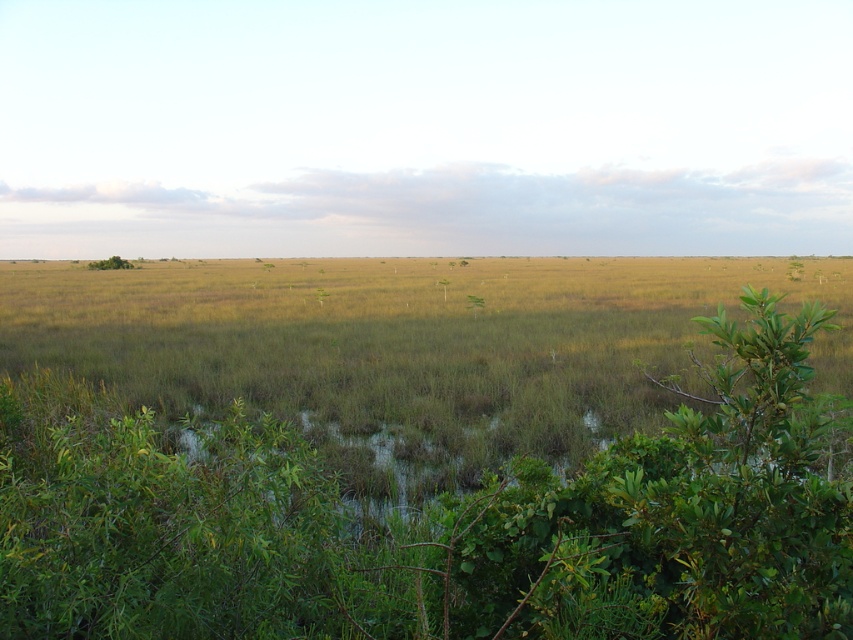
Question: Where is green leafy tree at center-right located in relation to green grassy tree at center in the image?

Choices:
 (A) above
 (B) below

Answer: (A)

Question: Which point is closer to the camera?

Choices:
 (A) green leafy tree at upper left
 (B) green leafy tree at center-right

Answer: (B)

Question: In this image, where is green leafy tree at center-right located relative to green grassy tree at center?

Choices:
 (A) above
 (B) below

Answer: (A)

Question: Can you confirm if green leafy tree at upper left is positioned to the left of green grassy tree at center?

Choices:
 (A) no
 (B) yes

Answer: (B)

Question: Which point is closer to the camera taking this photo?

Choices:
 (A) (120, 268)
 (B) (444, 300)
 (C) (792, 278)
 (D) (318, 289)

Answer: (B)

Question: Among these objects, which one is farthest from the camera?

Choices:
 (A) green grassy tree at center
 (B) green leafy tree at center-right
 (C) green leafy tree at center
 (D) green leafy tree at upper left

Answer: (D)